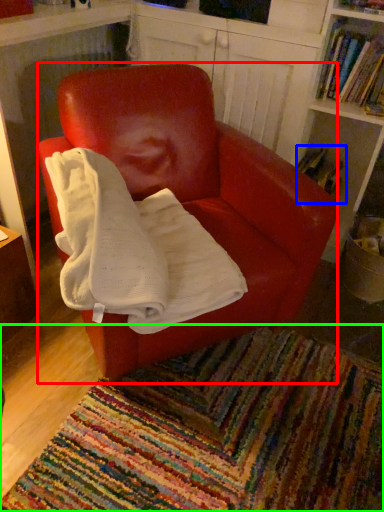
Question: Which is nearer to the chair (highlighted by a red box)? book (highlighted by a blue box) or mat (highlighted by a green box).

Choices:
 (A) book
 (B) mat

Answer: (B)